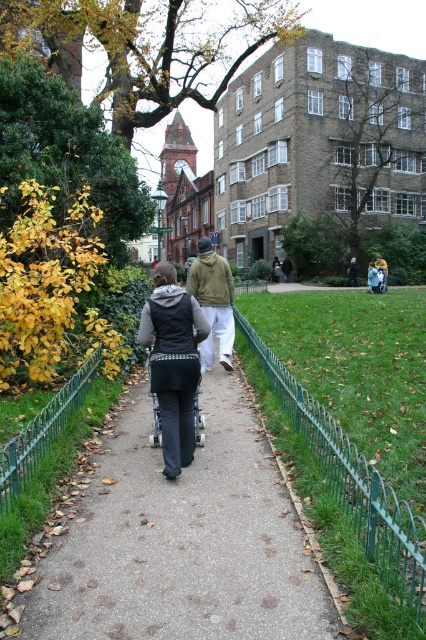
Can you confirm if light brown cotton hoodie at center is positioned to the right of matte green jacket at center?

Incorrect, light brown cotton hoodie at center is not on the right side of matte green jacket at center.

I want to click on light brown cotton hoodie at center, so click(213, 301).

At what (x,y) coordinates should I click in order to perform the action: click on light brown cotton hoodie at center. Please return your answer as a coordinate pair (x, y). The width and height of the screenshot is (426, 640). Looking at the image, I should click on (213, 301).

Is point (89, 611) closer to camera compared to point (157, 424)?

Yes, point (89, 611) is in front of point (157, 424).

Can you confirm if concrete pavement at center is positioned to the left of metallic blue baby carriage at center?

Yes, concrete pavement at center is to the left of metallic blue baby carriage at center.

Between point (126, 625) and point (158, 428), which one is positioned in front?

Point (126, 625)

The width and height of the screenshot is (426, 640). I want to click on concrete pavement at center, so click(x=183, y=540).

Does matte black vest at center appear under light brown cotton hoodie at center?

Correct, matte black vest at center is located below light brown cotton hoodie at center.

Is matte black vest at center to the left of light brown cotton hoodie at center from the viewer's perspective?

Correct, you'll find matte black vest at center to the left of light brown cotton hoodie at center.

Where is `matte black vest at center`? This screenshot has width=426, height=640. matte black vest at center is located at coordinates (173, 362).

Where is `matte black vest at center`? matte black vest at center is located at coordinates (173, 362).